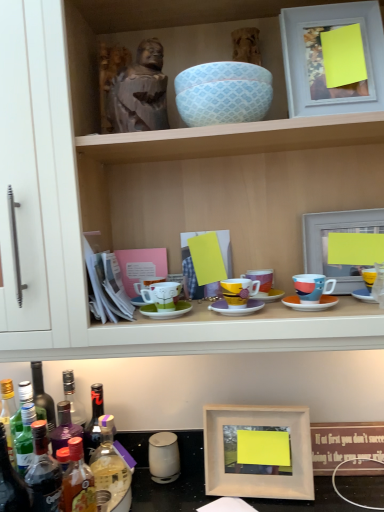
Question: Is matte ceramic mug at right, which ranks as the 4th coffee cup in left-to-right order, to the left or to the right of wooden statue at upper center in the image?

Choices:
 (A) right
 (B) left

Answer: (A)

Question: Is point (334, 281) closer or farther from the camera than point (216, 223)?

Choices:
 (A) farther
 (B) closer

Answer: (B)

Question: Based on their relative distances, which object is nearer to the translucent glass bottle at lower left, the first bottle in the left-to-right sequence?

Choices:
 (A) translucent plastic bottle at lower left, placed as the second bottle when sorted from left to right
 (B) wooden picture frame at lower center, placed as the third picture frame when sorted from top to bottom
 (C) translucent plastic bottle at lower left, the first bottle viewed from the right
 (D) matte ceramic coffee cup at center, placed as the second coffee cup when sorted from left to right
 (E) wooden picture frame at lower right, acting as the 1th picture frame starting from the bottom

Answer: (A)

Question: Which object is the closest to the matte white picture frame at upper right, the fourth picture frame when ordered from bottom to top?

Choices:
 (A) matte ceramic coffee cup at center, placed as the second coffee cup when sorted from left to right
 (B) wooden picture frame at lower center, which is the second picture frame in bottom-to-top order
 (C) matte ceramic mug at right, which ranks as the 4th coffee cup in left-to-right order
 (D) translucent plastic bottle at lower left, the 3th bottle when ordered from left to right
 (E) wooden statue at upper center

Answer: (E)